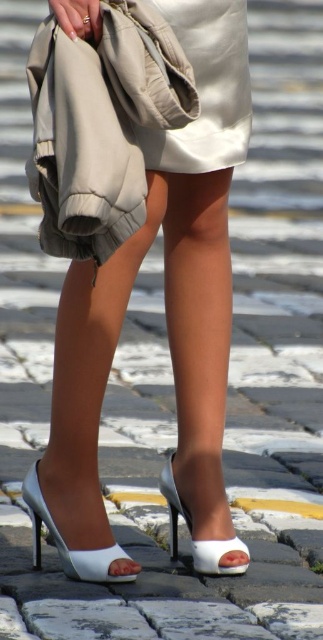
Who is taller, white leather sandal at lower center or white leather sandal at center?

With more height is white leather sandal at center.

Who is more distant from viewer, (28, 472) or (236, 544)?

The point (28, 472) is behind.

You are a GUI agent. You are given a task and a screenshot of the screen. Output one action in this format:
    pyautogui.click(x=<x>, y=<y>)
    Task: Click on the white leather sandal at lower center
    This screenshot has height=640, width=323.
    Given the screenshot: What is the action you would take?
    pyautogui.click(x=64, y=541)

Can you confirm if white leather high heels at center is positioned to the left of white leather sandal at lower center?

Incorrect, white leather high heels at center is not on the left side of white leather sandal at lower center.

Does white leather high heels at center appear under white leather sandal at lower center?

Incorrect, white leather high heels at center is not positioned below white leather sandal at lower center.

At what (x,y) coordinates should I click in order to perform the action: click on white leather high heels at center. Please return your answer as a coordinate pair (x, y). Looking at the image, I should click on (137, 252).

Locate an element on the screen. The height and width of the screenshot is (640, 323). white leather high heels at center is located at coordinates (137, 252).

Which of these two, white leather high heels at center or beige quilted fabric trench coat at upper left, stands shorter?

beige quilted fabric trench coat at upper left is shorter.

Can you confirm if white leather high heels at center is thinner than beige quilted fabric trench coat at upper left?

No, white leather high heels at center is not thinner than beige quilted fabric trench coat at upper left.

Does point (170, 161) come behind point (156, 97)?

Yes, it is.

You are a GUI agent. You are given a task and a screenshot of the screen. Output one action in this format:
    pyautogui.click(x=<x>, y=<y>)
    Task: Click on the white leather high heels at center
    The image size is (323, 640).
    Given the screenshot: What is the action you would take?
    pyautogui.click(x=137, y=252)